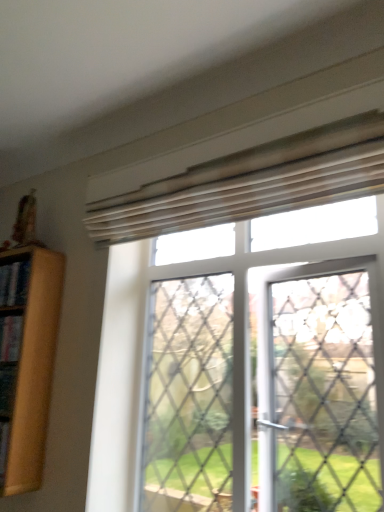
Question: Looking at the image, does wooden bookshelf at left seem bigger or smaller compared to translucent wood blinds at upper center?

Choices:
 (A) big
 (B) small

Answer: (B)

Question: From the image's perspective, relative to translucent wood blinds at upper center, is wooden bookshelf at left above or below?

Choices:
 (A) above
 (B) below

Answer: (B)

Question: Choose the correct answer: Is wooden bookshelf at left inside translucent wood blinds at upper center or outside it?

Choices:
 (A) inside
 (B) outside

Answer: (B)

Question: From a real-world perspective, is translucent wood blinds at upper center positioned above or below wooden bookshelf at left?

Choices:
 (A) below
 (B) above

Answer: (B)

Question: Is translucent wood blinds at upper center taller or shorter than wooden bookshelf at left?

Choices:
 (A) short
 (B) tall

Answer: (B)

Question: Is translucent wood blinds at upper center inside or outside of wooden bookshelf at left?

Choices:
 (A) outside
 (B) inside

Answer: (A)

Question: From the image's perspective, is translucent wood blinds at upper center located above or below wooden bookshelf at left?

Choices:
 (A) below
 (B) above

Answer: (B)